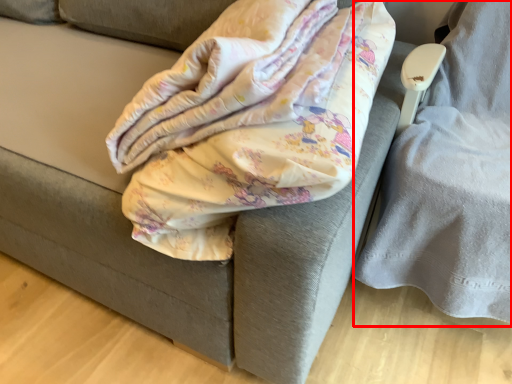
Question: Observing the image, what is the correct spatial positioning of swivel chair (annotated by the red box) in reference to blanket?

Choices:
 (A) left
 (B) right

Answer: (B)